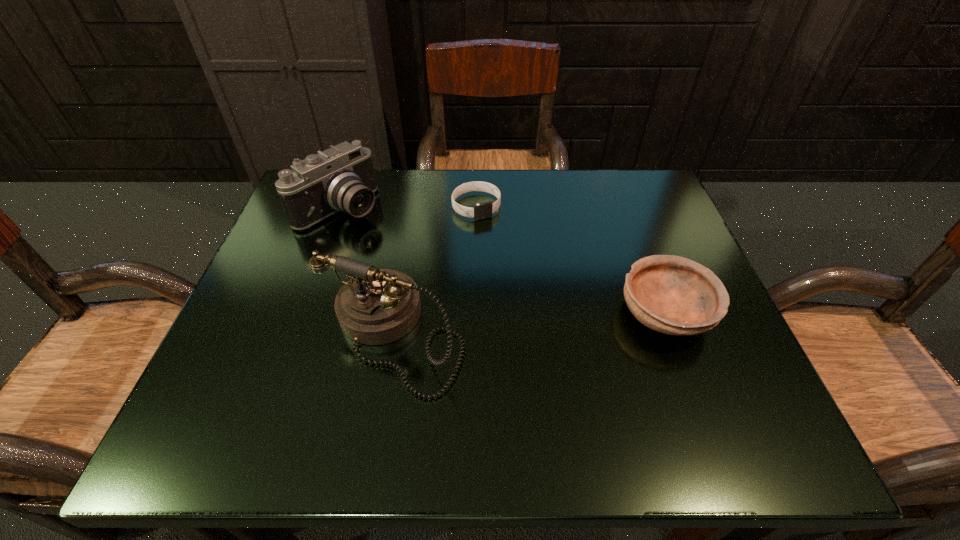
Locate an element on the screen. telephone is located at coordinates (376, 306).

What are the coordinates of `bowl` in the screenshot? It's located at (673, 295).

The image size is (960, 540). I want to click on the rightmost object, so click(673, 295).

Where is `camera`? Image resolution: width=960 pixels, height=540 pixels. camera is located at coordinates (342, 178).

Find the location of `the shortest object`. the shortest object is located at coordinates (480, 211).

You are a GUI agent. You are given a task and a screenshot of the screen. Output one action in this format:
    pyautogui.click(x=<x>, y=<y>)
    Task: Click on the free space located on the left of the telephone
    The height and width of the screenshot is (540, 960).
    Given the screenshot: What is the action you would take?
    pyautogui.click(x=276, y=335)

Image resolution: width=960 pixels, height=540 pixels. Identify the location of free region located on the front of the third tallest object. (697, 399).

Identify the location of blank area located 0.330m on the front-facing side of the camera. (471, 297).

Locate an element on the screen. free region located 0.200m on the front-facing side of the camera is located at coordinates (425, 266).

Locate an element on the screen. The width and height of the screenshot is (960, 540). free space located on the front-facing side of the camera is located at coordinates (445, 280).